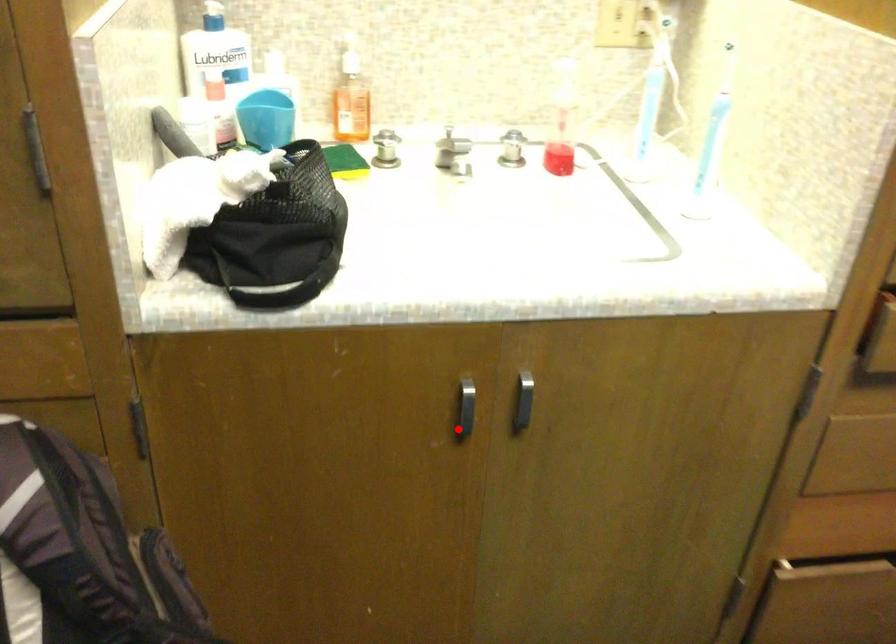
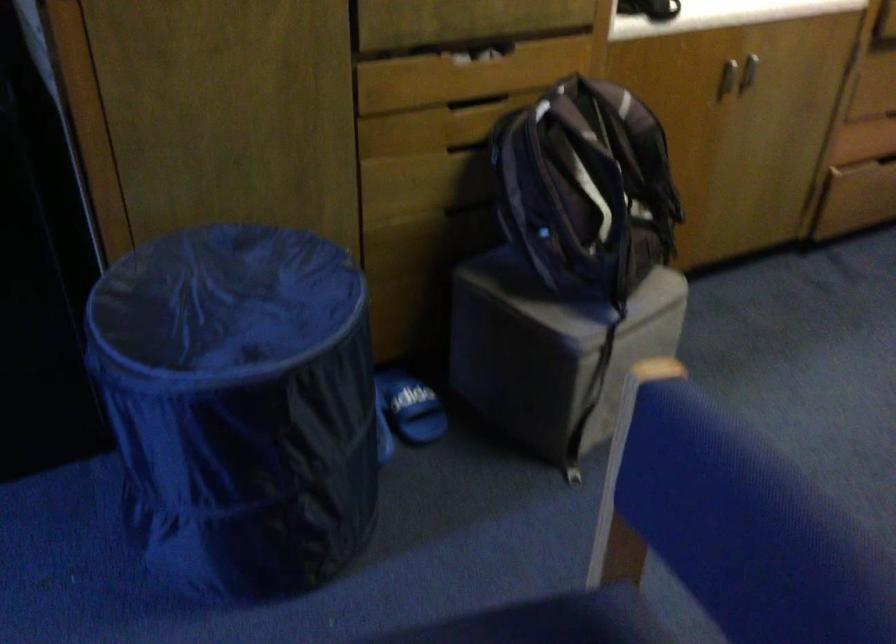
Question: I am providing you with two images of the same scene from different viewpoints. Image1 has a red point marked. In image2, the corresponding 3D location appears at what relative position? Reply with the corresponding letter.

Choices:
 (A) Closer
 (B) Farther

Answer: (B)